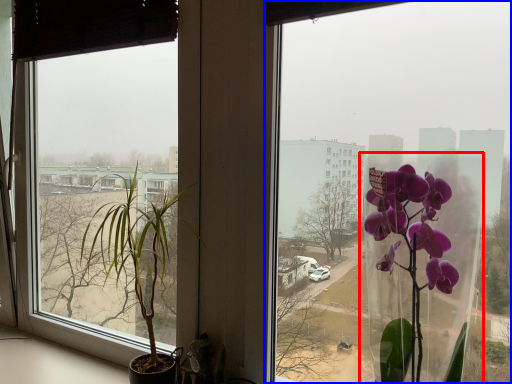
Question: Which point is closer to the camera, glass vase (highlighted by a red box) or window (highlighted by a blue box)?

Choices:
 (A) glass vase
 (B) window

Answer: (A)